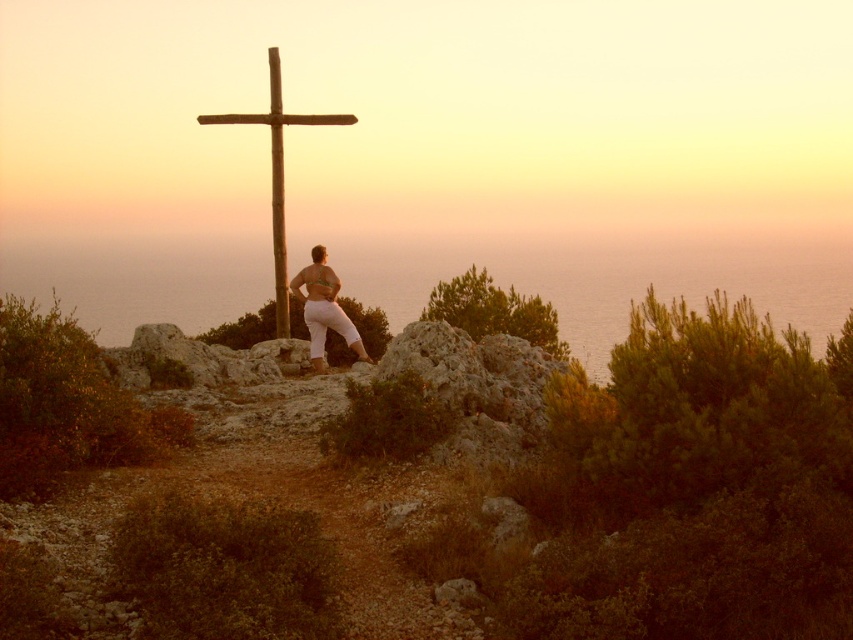
Who is lower down, wooden cross at center or matte white pants at center?

matte white pants at center is below.

Is wooden cross at center to the left of matte white pants at center from the viewer's perspective?

Yes, wooden cross at center is to the left of matte white pants at center.

You are a GUI agent. You are given a task and a screenshot of the screen. Output one action in this format:
    pyautogui.click(x=<x>, y=<y>)
    Task: Click on the wooden cross at center
    
    Given the screenshot: What is the action you would take?
    pyautogui.click(x=277, y=172)

Locate an element on the screen. wooden cross at center is located at coordinates click(x=277, y=172).